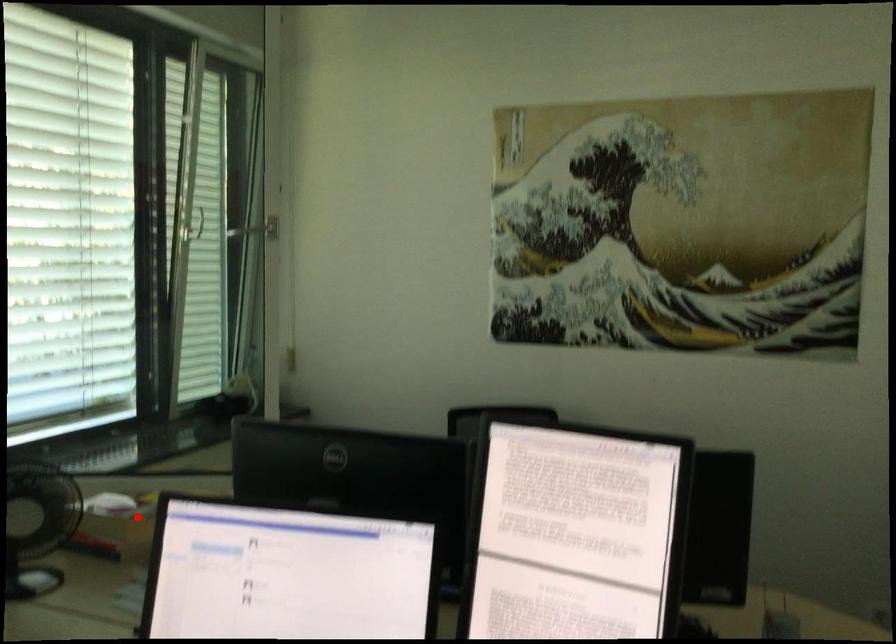
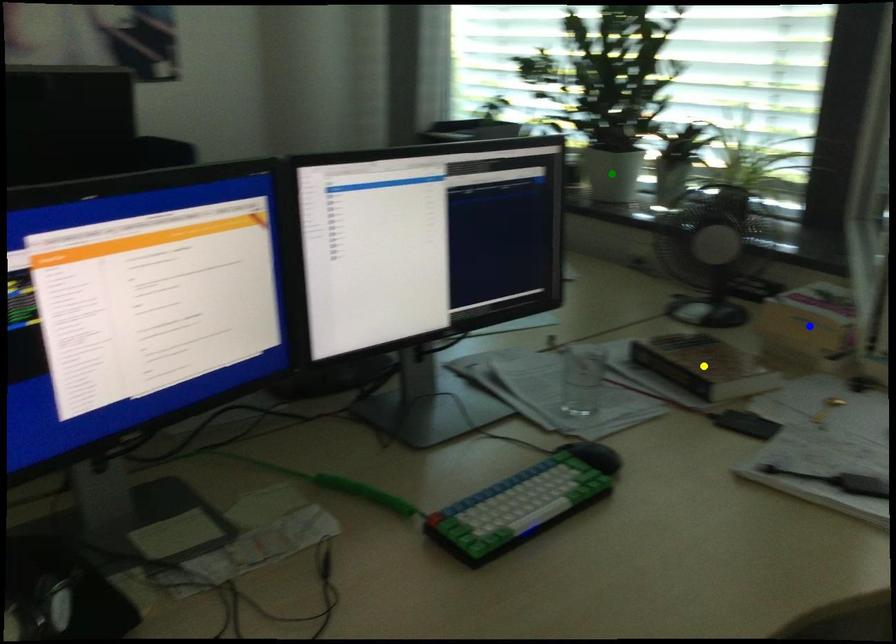
Question: I am providing you with two images of the same scene from different viewpoints. A red point is marked on the first image. You are given multiple points on the second image. Which point in image 2 represents the same 3d spot as the red point in image 1?

Choices:
 (A) green point
 (B) blue point
 (C) yellow point

Answer: (B)